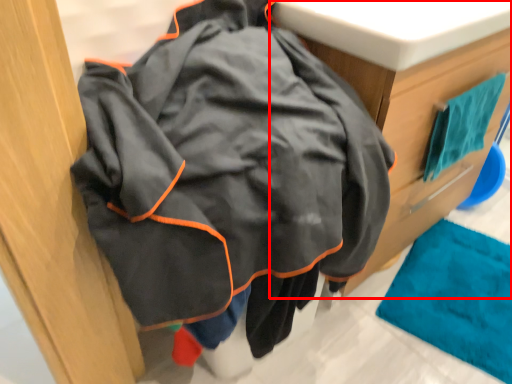
Question: From the image's perspective, what is the correct spatial positioning of furniture (annotated by the red box) in reference to bath towel?

Choices:
 (A) below
 (B) above

Answer: (A)